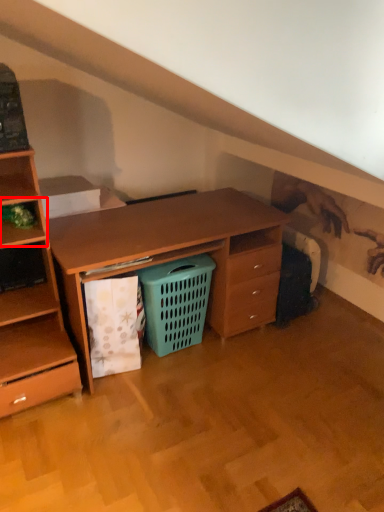
Question: Where is shelf (annotated by the red box) located in relation to shopping basket in the image?

Choices:
 (A) right
 (B) left

Answer: (B)